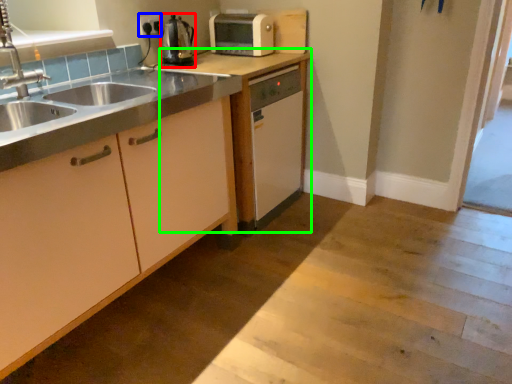
Question: Based on their relative distances, which object is nearer to kitchen appliance (highlighted by a red box)? Choose from electric outlet (highlighted by a blue box) and cabinetry (highlighted by a green box).

Choices:
 (A) electric outlet
 (B) cabinetry

Answer: (A)